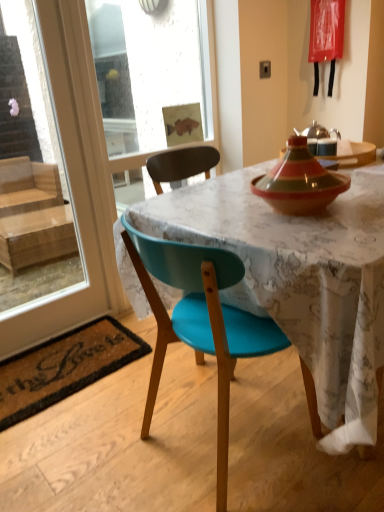
Image resolution: width=384 pixels, height=512 pixels. Find the location of `free point above coir mat at lower left (from a real-world perspective)`. free point above coir mat at lower left (from a real-world perspective) is located at coordinates pos(59,357).